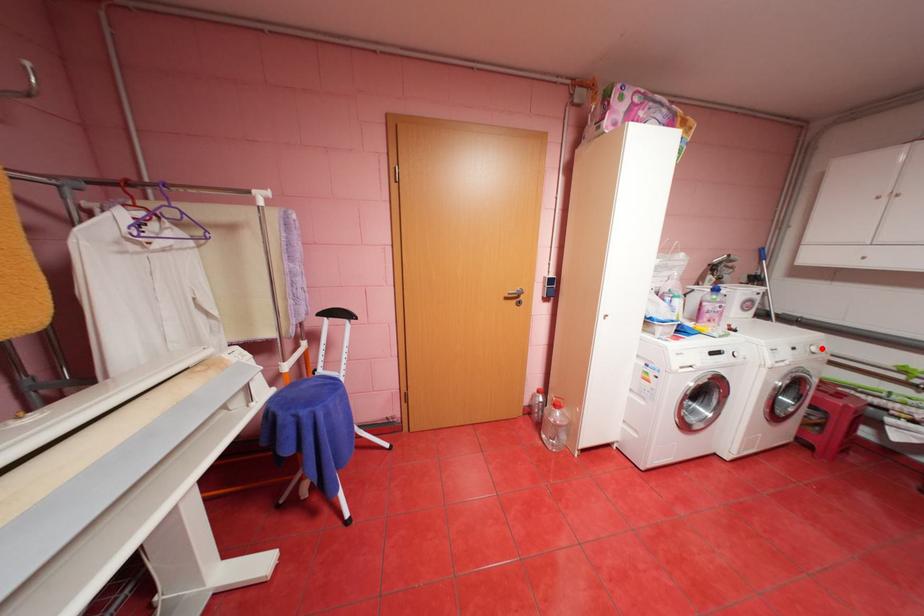
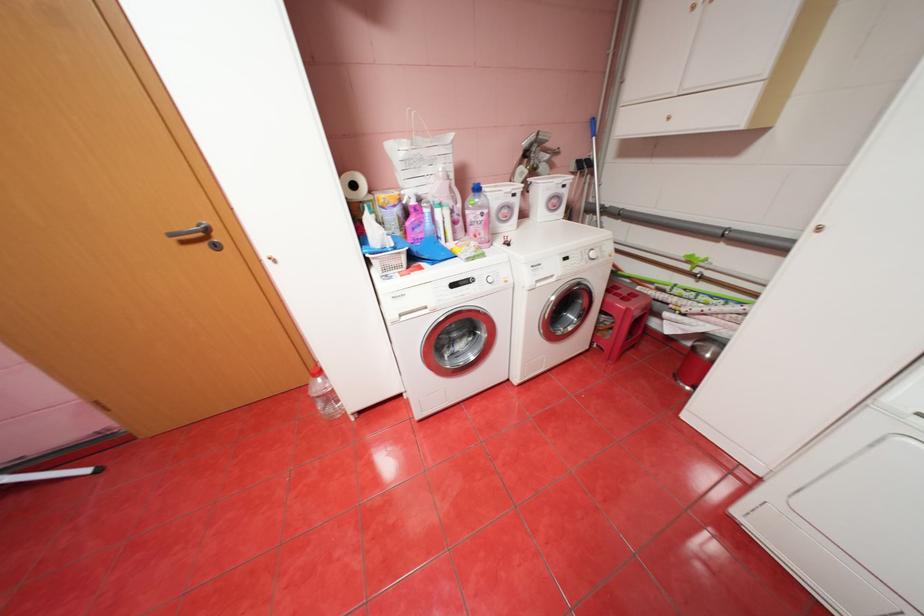
Question: I am providing you with two images of the same scene from different viewpoints. A red point is marked on the first image. Is the red point's position out of view in image 2?

Choices:
 (A) Yes
 (B) No

Answer: (B)